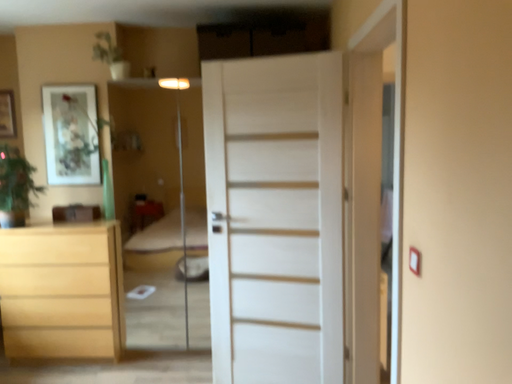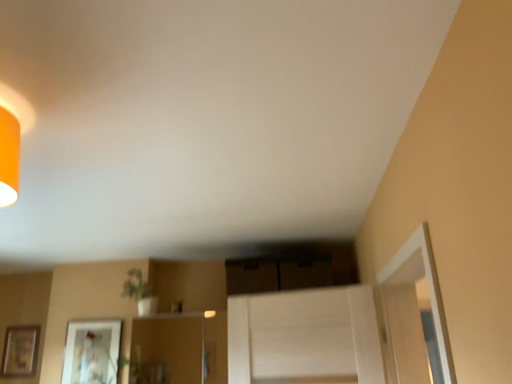
Question: Which way did the camera rotate in the video?

Choices:
 (A) rotated downward
 (B) rotated upward

Answer: (B)